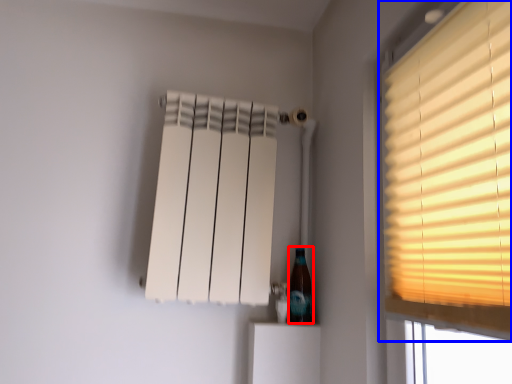
Question: Among these objects, which one is farthest to the camera, bottle (highlighted by a red box) or window (highlighted by a blue box)?

Choices:
 (A) bottle
 (B) window

Answer: (A)